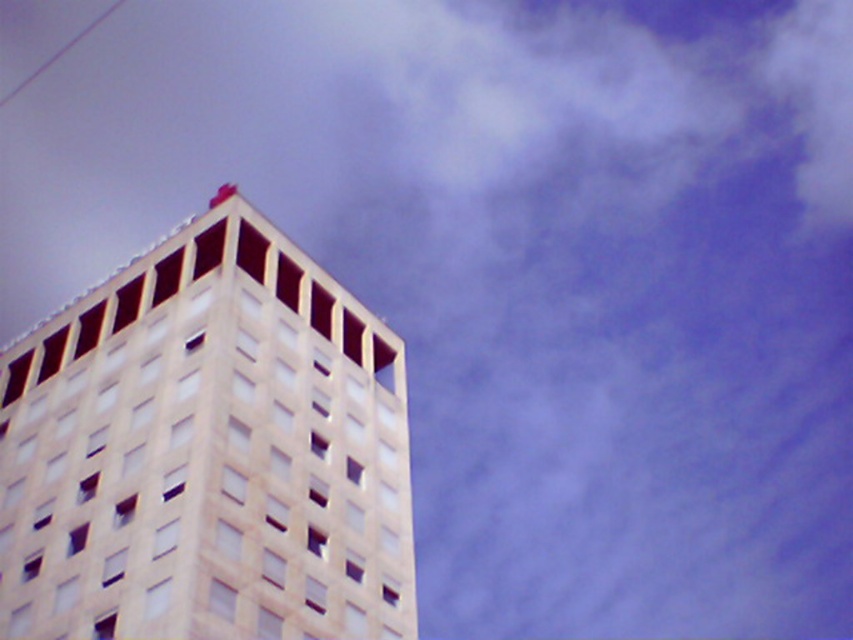
Can you confirm if white stone building at upper left is positioned below smooth white wire at upper left?

Correct, white stone building at upper left is located below smooth white wire at upper left.

Is the position of white stone building at upper left less distant than that of smooth white wire at upper left?

Yes, white stone building at upper left is closer to the viewer.

Does point (254, 342) come closer to viewer compared to point (123, 3)?

Yes, point (254, 342) is closer to viewer.

Locate an element on the screen. The width and height of the screenshot is (853, 640). white stone building at upper left is located at coordinates (207, 451).